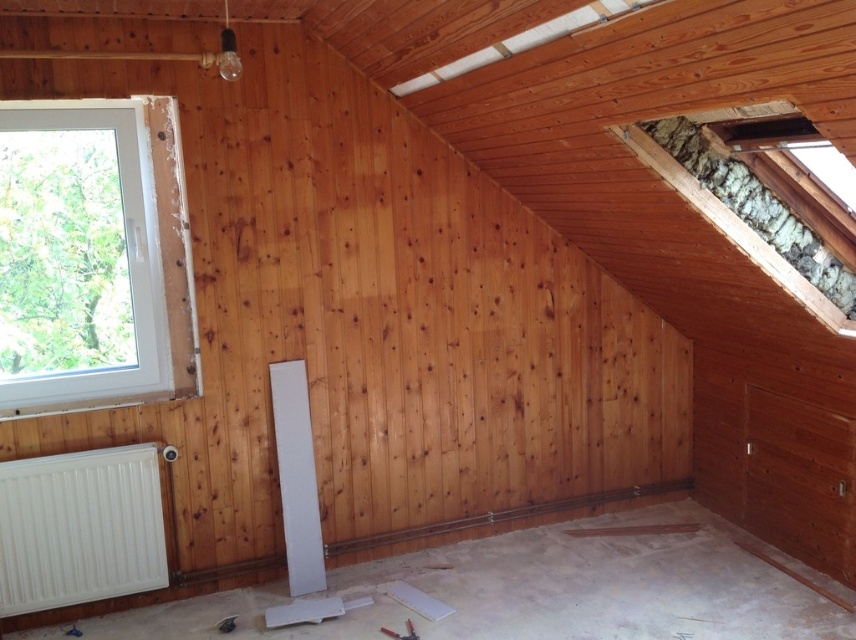
You are standing in the room and want to reach the white plastic window at left to open it. Is the white matte radiator at lower left blocking your path to the window?

The white matte radiator at lower left is behind the white plastic window at left, so it does not block the path to the window. You can reach the window without any obstruction from the radiator.